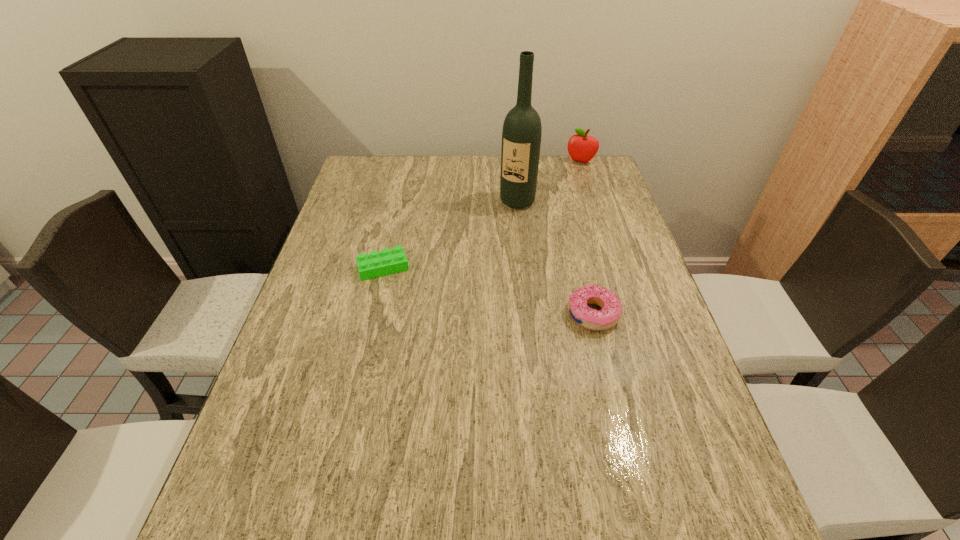
At what (x,y) coordinates should I click in order to perform the action: click on object at the far right corner. Please return your answer as a coordinate pair (x, y). This screenshot has height=540, width=960. Looking at the image, I should click on (582, 148).

In the image, there is a desktop. Find the location of `free space at the far edge`. free space at the far edge is located at coordinates (412, 174).

The height and width of the screenshot is (540, 960). Identify the location of free spot at the near edge of the desktop. (408, 475).

The height and width of the screenshot is (540, 960). Identify the location of vacant space at the left edge. (334, 308).

In the image, there is a desktop. At what (x,y) coordinates should I click in order to perform the action: click on vacant space at the right edge. Please return your answer as a coordinate pair (x, y). The width and height of the screenshot is (960, 540). Looking at the image, I should click on (642, 282).

This screenshot has height=540, width=960. In the image, there is a desktop. Identify the location of free space at the far left corner. (391, 192).

Where is `vacant area at the far right corner`? This screenshot has height=540, width=960. vacant area at the far right corner is located at coordinates (602, 173).

The width and height of the screenshot is (960, 540). I want to click on free space that is in between the doughnut and the leftmost object, so click(x=488, y=291).

Locate an element on the screen. Image resolution: width=960 pixels, height=540 pixels. blank region between the nearest object and the Lego is located at coordinates (488, 291).

Where is `vacant space in between the farthest object and the third farthest object`? vacant space in between the farthest object and the third farthest object is located at coordinates (482, 215).